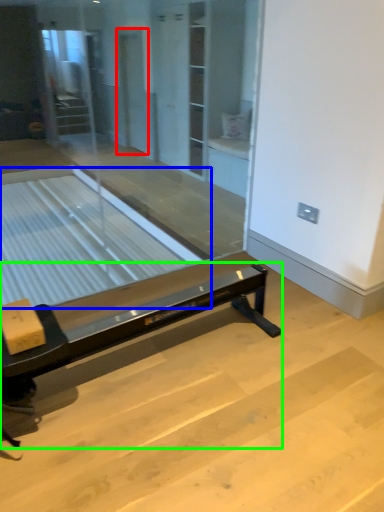
Question: Which object is the closest to the screen door (highlighted by a red box)? Choose among these: table (highlighted by a blue box) or furniture (highlighted by a green box).

Choices:
 (A) table
 (B) furniture

Answer: (A)